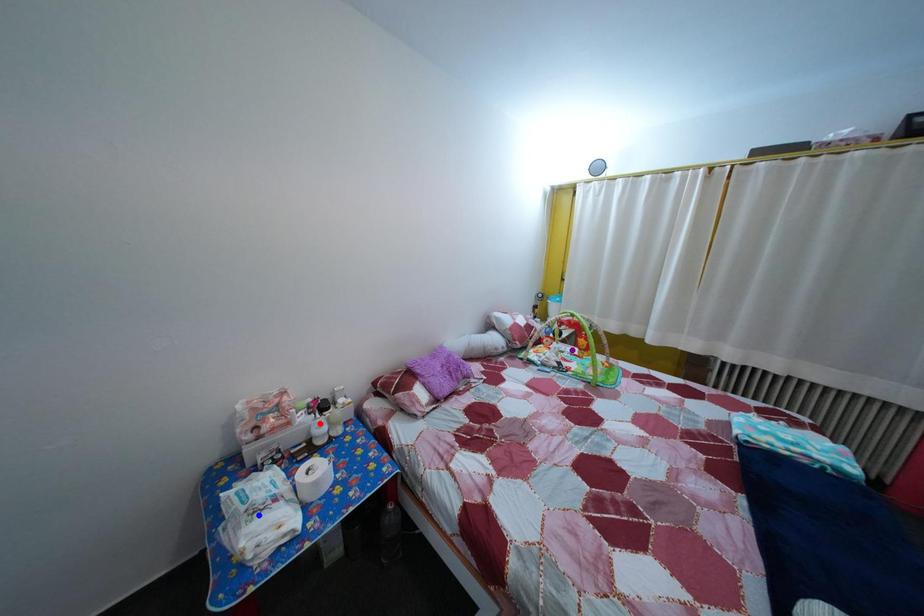
Order these from nearest to farthest:
1. purple point
2. blue point
3. red point

blue point → red point → purple point